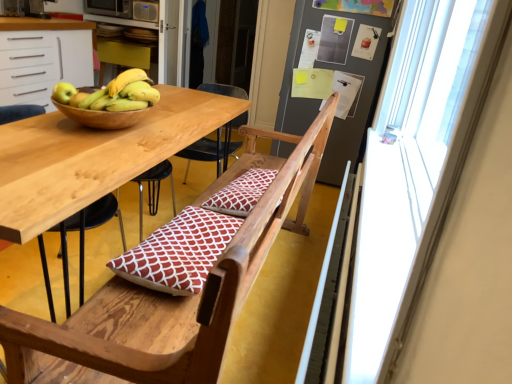
Question: From a real-world perspective, does metallic microwave at upper left sit lower than transparent plastic screen door at upper center?

Choices:
 (A) no
 (B) yes

Answer: (A)

Question: Considering the relative sizes of metallic microwave at upper left and transparent plastic screen door at upper center in the image provided, is metallic microwave at upper left bigger than transparent plastic screen door at upper center?

Choices:
 (A) yes
 (B) no

Answer: (B)

Question: Is the surface of metallic microwave at upper left in direct contact with transparent plastic screen door at upper center?

Choices:
 (A) yes
 (B) no

Answer: (B)

Question: From a real-world perspective, is metallic microwave at upper left on top of transparent plastic screen door at upper center?

Choices:
 (A) yes
 (B) no

Answer: (A)

Question: Is metallic microwave at upper left closer to the viewer compared to transparent plastic screen door at upper center?

Choices:
 (A) yes
 (B) no

Answer: (B)

Question: Is transparent glass window at right wider or thinner than red printed cushion at center?

Choices:
 (A) thin
 (B) wide

Answer: (B)

Question: From a real-world perspective, is transparent glass window at right physically located above or below red printed cushion at center?

Choices:
 (A) below
 (B) above

Answer: (B)

Question: From the image's perspective, is transparent glass window at right located above or below red printed cushion at center?

Choices:
 (A) below
 (B) above

Answer: (B)

Question: Is transparent glass window at right in front of or behind red printed cushion at center in the image?

Choices:
 (A) behind
 (B) front

Answer: (B)

Question: Would you say metallic microwave at upper left is to the left or to the right of red printed cushion at center in the picture?

Choices:
 (A) right
 (B) left

Answer: (B)

Question: From their relative heights in the image, would you say metallic microwave at upper left is taller or shorter than red printed cushion at center?

Choices:
 (A) short
 (B) tall

Answer: (B)

Question: From the image's perspective, is metallic microwave at upper left above or below red printed cushion at center?

Choices:
 (A) below
 (B) above

Answer: (B)

Question: Is metallic microwave at upper left in front of or behind red printed cushion at center in the image?

Choices:
 (A) behind
 (B) front

Answer: (A)

Question: From a real-world perspective, is transparent glass window at right positioned above or below metallic microwave at upper left?

Choices:
 (A) above
 (B) below

Answer: (B)

Question: Looking at the image, does transparent glass window at right seem bigger or smaller compared to metallic microwave at upper left?

Choices:
 (A) big
 (B) small

Answer: (A)